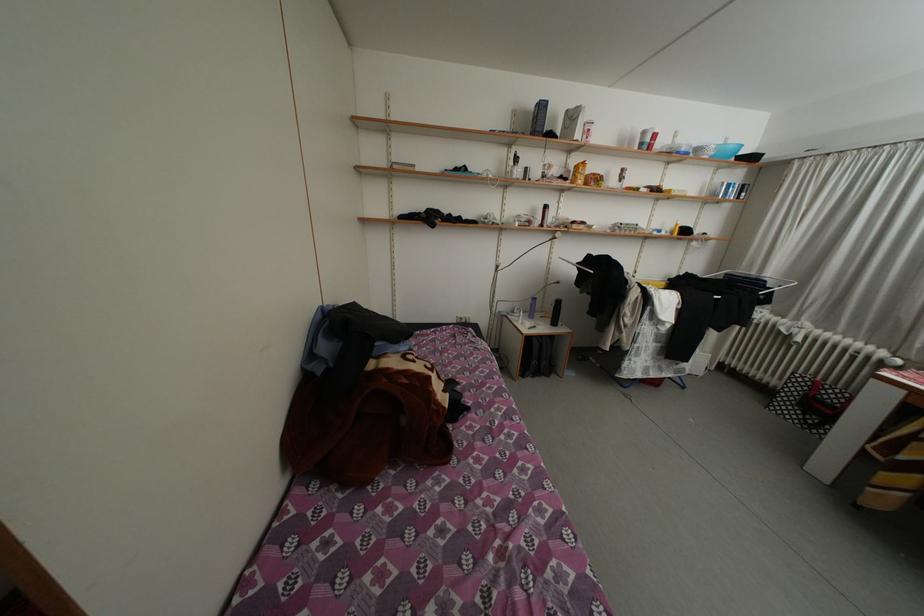
Where is `clothes drying rack`? The image size is (924, 616). clothes drying rack is located at coordinates (670, 315).